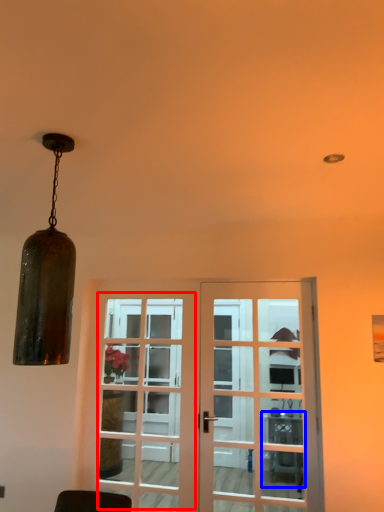
Question: Which of the following is the farthest to the observer, screen door (highlighted by a red box) or table (highlighted by a blue box)?

Choices:
 (A) screen door
 (B) table

Answer: (B)